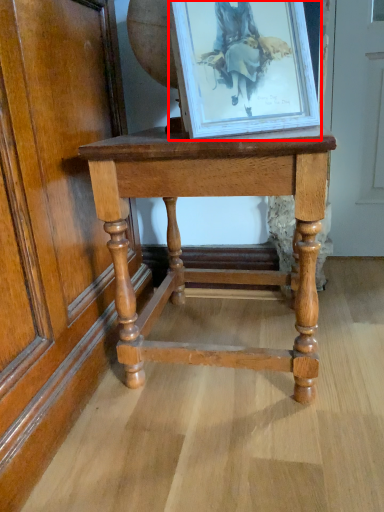
Question: From the image's perspective, what is the correct spatial relationship of picture frame (annotated by the red box) in relation to table?

Choices:
 (A) above
 (B) below

Answer: (A)